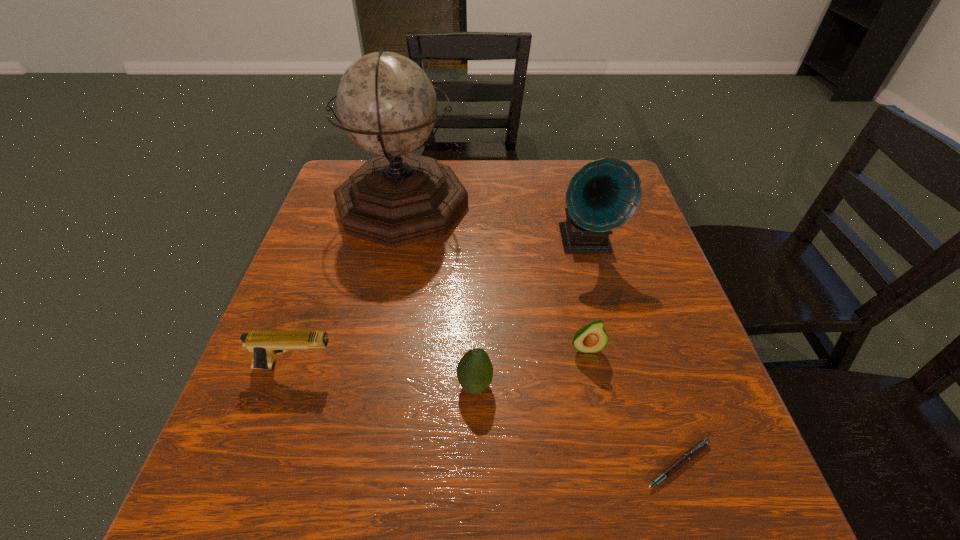
Image resolution: width=960 pixels, height=540 pixels. I want to click on blank space located 0.150m at the barrel of the pistol, so [418, 367].

I want to click on free space located on the back of the nearer avocado, so click(476, 305).

You are a GUI agent. You are given a task and a screenshot of the screen. Output one action in this format:
    pyautogui.click(x=<x>, y=<y>)
    Task: Click on the free region located 0.150m on the cut side of the right avocado
    The height and width of the screenshot is (540, 960).
    Given the screenshot: What is the action you would take?
    coord(604,433)

Where is `object present at the far edge`? object present at the far edge is located at coordinates (386, 103).

The image size is (960, 540). In order to click on object positioned at the near edge in this screenshot , I will do `click(692, 452)`.

You are a GUI agent. You are given a task and a screenshot of the screen. Output one action in this format:
    pyautogui.click(x=<x>, y=<y>)
    Task: Click on the globe located at the left edge
    Image resolution: width=960 pixels, height=540 pixels.
    Given the screenshot: What is the action you would take?
    pyautogui.click(x=386, y=103)

The width and height of the screenshot is (960, 540). What are the coordinates of `pistol at the left edge` in the screenshot? It's located at (263, 345).

You are a GUI agent. You are given a task and a screenshot of the screen. Output one action in this format:
    pyautogui.click(x=<x>, y=<y>)
    Task: Click on the phonograph_record located at the right edge
    The height and width of the screenshot is (540, 960).
    Given the screenshot: What is the action you would take?
    pyautogui.click(x=604, y=194)

Find the location of a particular element. The image size is (960, 540). pen at the right edge is located at coordinates (692, 452).

You are a GUI agent. You are given a task and a screenshot of the screen. Output one action in this format:
    pyautogui.click(x=<x>, y=<y>)
    Task: Click on the object situated at the far left corner
    
    Given the screenshot: What is the action you would take?
    pyautogui.click(x=386, y=103)